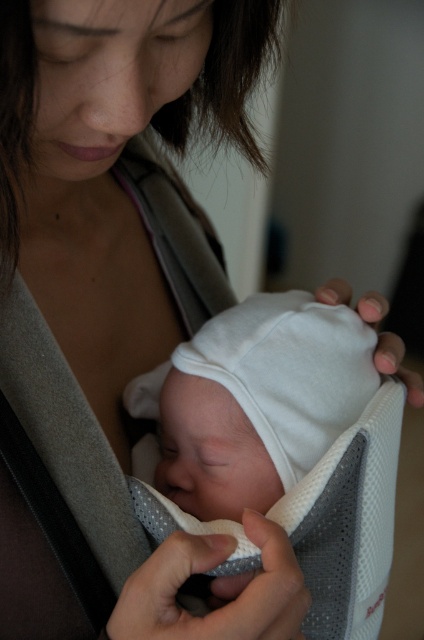
You are a photographer taking a closeup shot of the baby in the carrier. You need to focus on the white soft hat at center and the gray fabric strap at center. Which object is located to the right of the other?

The white soft hat at center is positioned on the right side of gray fabric strap at center.

You are a photographer taking a portrait of the woman and baby. You want to ensure the white soft hat at center and the gray fabric strap at center are both visible in the photo. Based on their positions, which one is closer to the bottom of the image?

The white soft hat at center is located below the gray fabric strap at center, so it is closer to the bottom of the image.

You are a nurse checking the baby in the carrier. The hospital policy requires that the baby hat must be at least 6 inches away from any straps to prevent choking hazards. Based on the image, does the white soft hat at center meet this requirement when compared to the gray fabric strap at center?

The white soft hat at center is 7.01 inches from the gray fabric strap at center, which exceeds the required 6 inches distance. Therefore, it meets the hospital policy requirement.